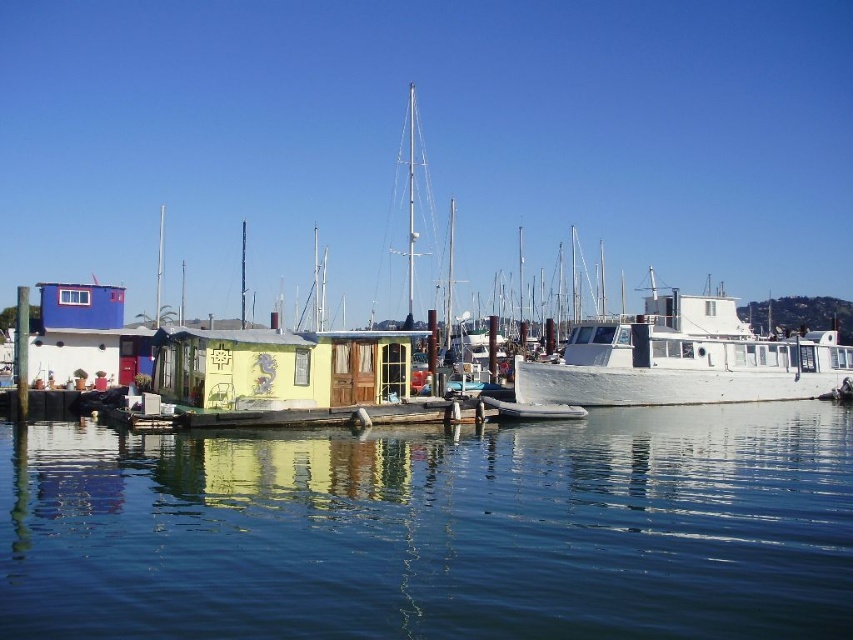
You are a sailor trying to navigate a small boat through the marina. You see the transparent blue water at center and the white matte boat at center. Which one is lower in height?

The transparent blue water at center is shorter than the white matte boat at center, so the transparent blue water at center is lower in height.

Consider the image. You are standing at the edge of the marina and notice two points marked on the image. The first point is at coordinates point (164, 448) and the second point is at point (804, 385). From your vantage point, which point is closer to you?

Point (164, 448) is in front of point (804, 385), so it is closer to you.